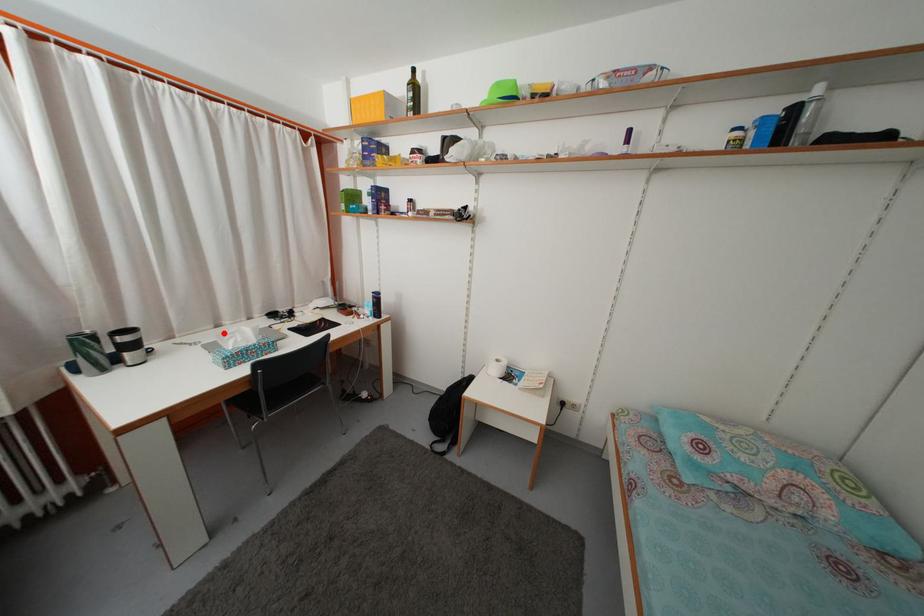
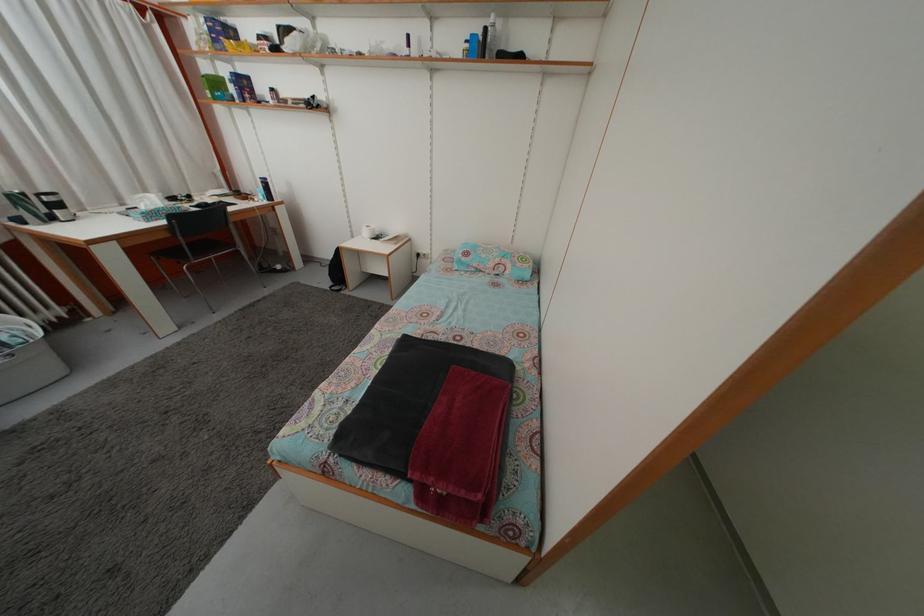
The point at the highlighted location is marked in the first image. Where is the corresponding point in the second image?

(128, 213)